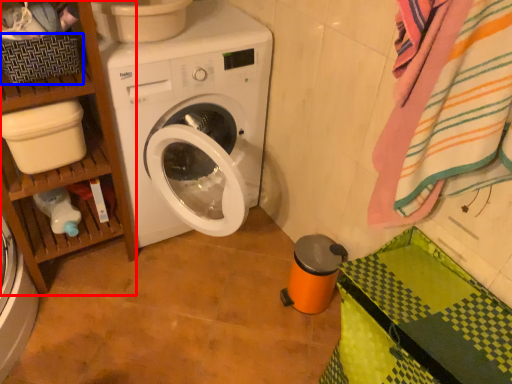
Question: Which point is closer to the camera, shelf (highlighted by a red box) or basket (highlighted by a blue box)?

Choices:
 (A) shelf
 (B) basket

Answer: (A)